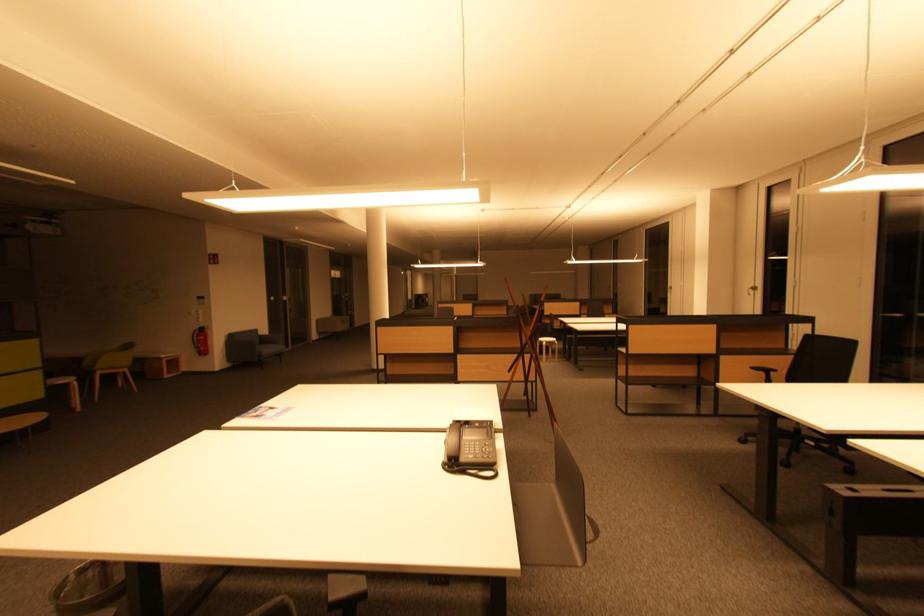
What do you see at coordinates (762, 369) in the screenshot? The height and width of the screenshot is (616, 924). I see `a chair armrest` at bounding box center [762, 369].